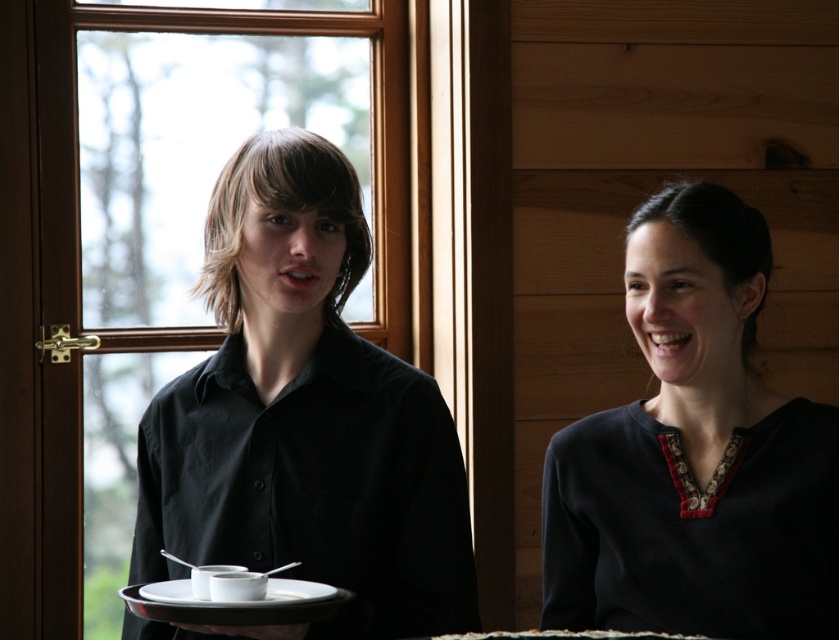
You are a delivery person trying to place a small package between the dark blue fabric at center and the white matte saucer at center. The package is 15 inches long. Can you fit it between them?

The dark blue fabric at center is 18.98 inches away from the white matte saucer at center. Since the package is 15 inches long, it can fit between them as the distance is sufficient.

You are a photographer setting up a shoot in this room. You need to ensure that the black matte shirt at center and the dark blue fabric at center are both visible in the frame. Based on their positions, which one should you focus on first to ensure both are in focus?

The black matte shirt at center is in front of the dark blue fabric at center, so you should focus on the dark blue fabric at center first to ensure both are in focus.